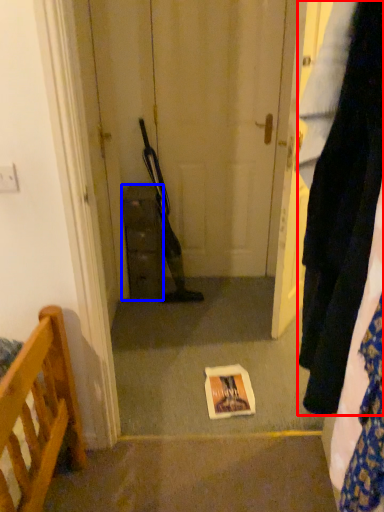
Question: Among these objects, which one is farthest to the camera, clothing (highlighted by a red box) or cabinetry (highlighted by a blue box)?

Choices:
 (A) clothing
 (B) cabinetry

Answer: (B)